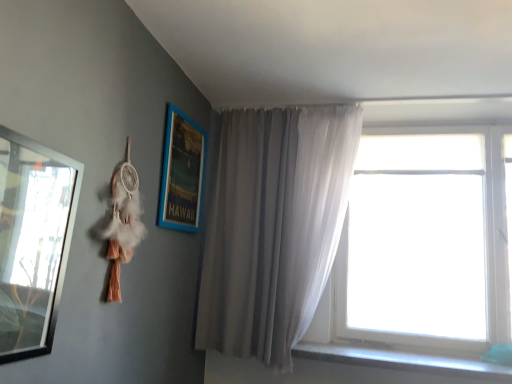
Question: Considering the positions of metallic silver mirror at left, positioned as the second picture frame in right-to-left order, and blue wooden picture frame at upper left, the second picture frame viewed from the front, in the image, is metallic silver mirror at left, positioned as the second picture frame in right-to-left order, wider or thinner than blue wooden picture frame at upper left, the second picture frame viewed from the front,?

Choices:
 (A) wide
 (B) thin

Answer: (A)

Question: Is point (54, 206) closer or farther from the camera than point (160, 216)?

Choices:
 (A) closer
 (B) farther

Answer: (A)

Question: Which is farther from the gray fabric curtain at center?

Choices:
 (A) metallic silver mirror at left, which ranks as the 1th picture frame in front-to-back order
 (B) gray concrete window sill at lower right
 (C) blue wooden picture frame at upper left, the second picture frame viewed from the front
 (D) transparent glass window at right

Answer: (A)

Question: Which is nearer to the gray concrete window sill at lower right?

Choices:
 (A) blue wooden picture frame at upper left, the second picture frame viewed from the front
 (B) transparent glass window at right
 (C) gray fabric curtain at center
 (D) metallic silver mirror at left, the 1th picture frame when ordered from left to right

Answer: (B)